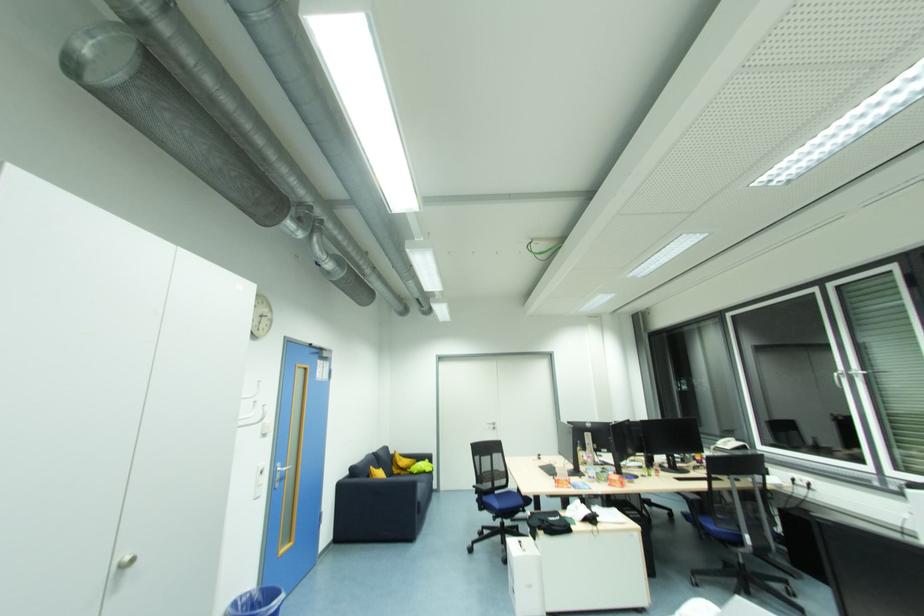
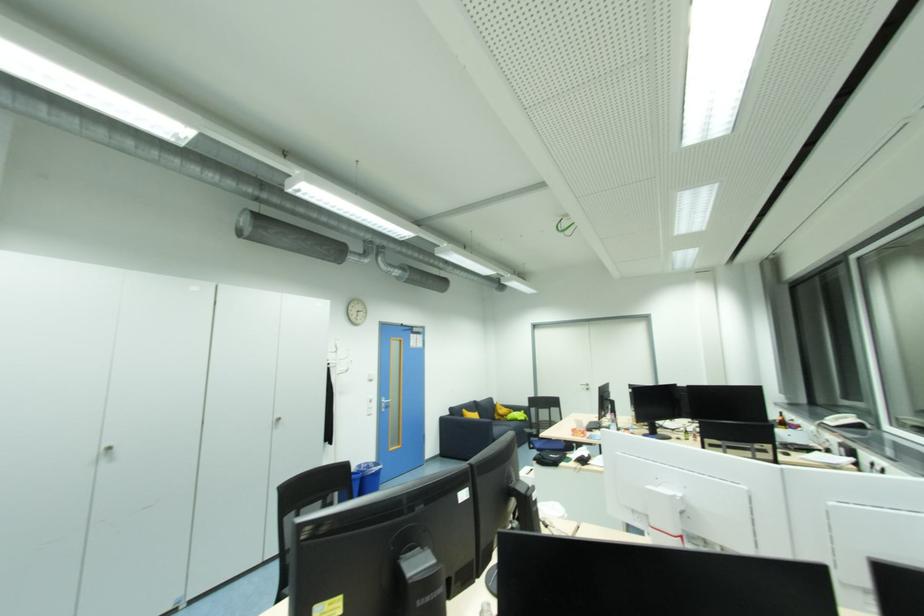
In the second image, find the point that corresponds to (282,469) in the first image.

(386, 402)